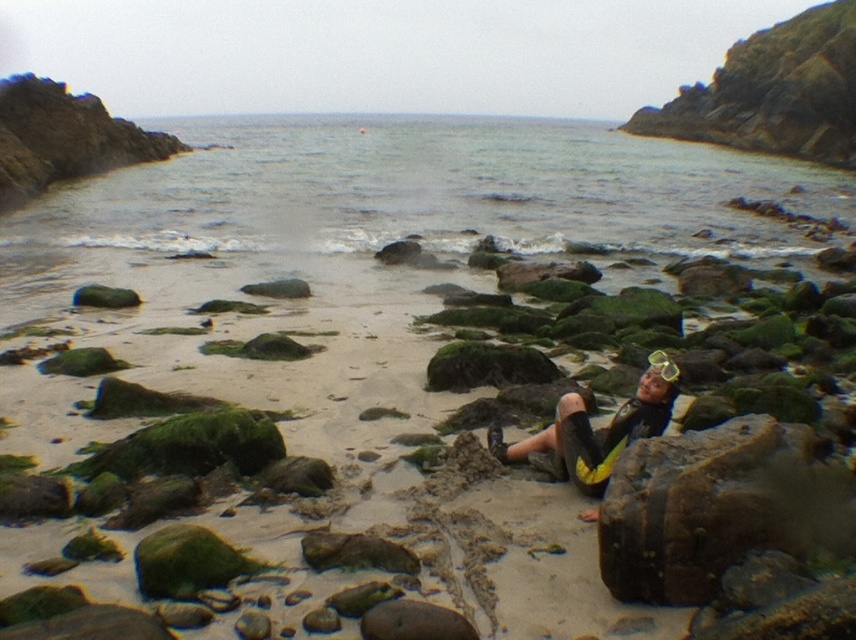
Can you confirm if yellow neoprene wetsuit at center is thinner than green mossy rock at center-left?

Incorrect, yellow neoprene wetsuit at center's width is not less than green mossy rock at center-left's.

Can you confirm if yellow neoprene wetsuit at center is bigger than green mossy rock at center-left?

Yes, yellow neoprene wetsuit at center is bigger than green mossy rock at center-left.

Is point (607, 426) farther from viewer compared to point (129, 304)?

No, it is not.

What are the coordinates of `yellow neoprene wetsuit at center` in the screenshot? It's located at (591, 435).

Can you confirm if green mossy rock at center-left is shorter than yellow matte goggles at center?

No.

Does green mossy rock at center-left have a larger size compared to yellow matte goggles at center?

Correct, green mossy rock at center-left is larger in size than yellow matte goggles at center.

Who is more forward, [123,298] or [663,369]?

Point [663,369] is in front.

This screenshot has height=640, width=856. What are the coordinates of `green mossy rock at center-left` in the screenshot? It's located at (104, 296).

Is the position of green mossy rock at center more distant than that of yellow neoprene wetsuit at center?

No, it is in front of yellow neoprene wetsuit at center.

Is green mossy rock at center taller than yellow neoprene wetsuit at center?

Yes, green mossy rock at center is taller than yellow neoprene wetsuit at center.

Is point (423, 573) positioned before point (657, 426)?

Yes, it is in front of point (657, 426).

Where is `green mossy rock at center`? green mossy rock at center is located at coordinates (281, 454).